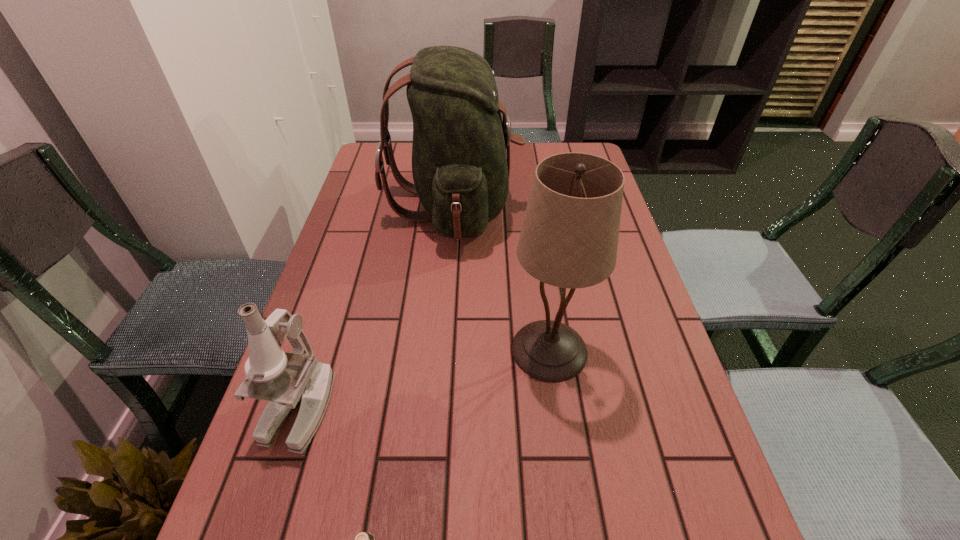
Find the location of a particular element. The image size is (960, 540). lampshade is located at coordinates pyautogui.click(x=569, y=238).

Where is `the farthest object`? the farthest object is located at coordinates (461, 174).

Identify the location of the leftmost object. The width and height of the screenshot is (960, 540). (287, 380).

Identify the location of the second shortest object. The image size is (960, 540). (287, 380).

Locate an element on the screen. vacant space situated 0.130m on the front-facing side of the lampshade is located at coordinates (450, 350).

The width and height of the screenshot is (960, 540). Find the location of `free region located 0.240m on the front-facing side of the lampshade`. free region located 0.240m on the front-facing side of the lampshade is located at coordinates (400, 350).

I want to click on free space located on the front-facing side of the lampshade, so click(442, 350).

This screenshot has width=960, height=540. Identify the location of vacant space located on the open flap of the backpack. (586, 206).

This screenshot has height=540, width=960. Identify the location of vacant region located on the front of the third tallest object. (273, 495).

Where is `object situated at the far edge`? The height and width of the screenshot is (540, 960). object situated at the far edge is located at coordinates (461, 174).